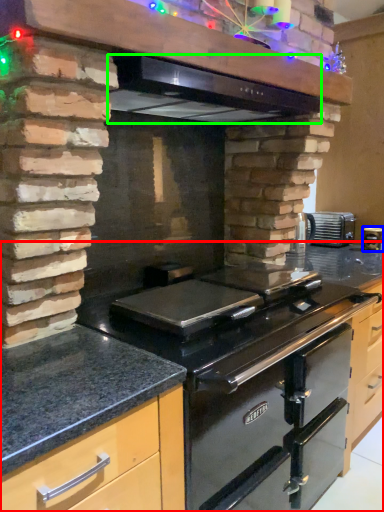
Question: Considering the real-world distances, which object is closest to countertop (highlighted by a red box)? kitchen appliance (highlighted by a blue box) or exhaust hood (highlighted by a green box).

Choices:
 (A) kitchen appliance
 (B) exhaust hood

Answer: (B)